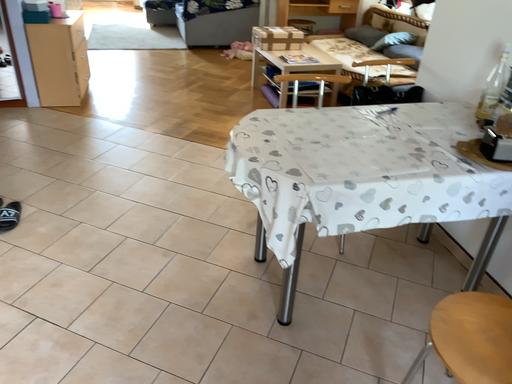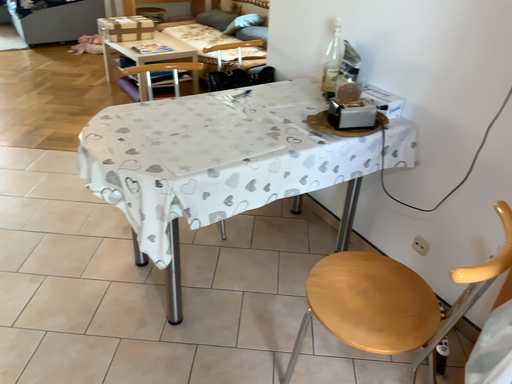
Question: Which way did the camera rotate in the video?

Choices:
 (A) rotated left
 (B) rotated right

Answer: (B)